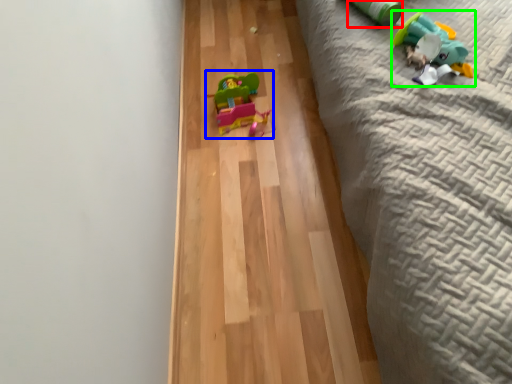
Question: Estimate the real-world distances between objects in this image. Which object is closer to toy (highlighted by a red box), toy (highlighted by a blue box) or toy (highlighted by a green box)?

Choices:
 (A) toy
 (B) toy

Answer: (B)